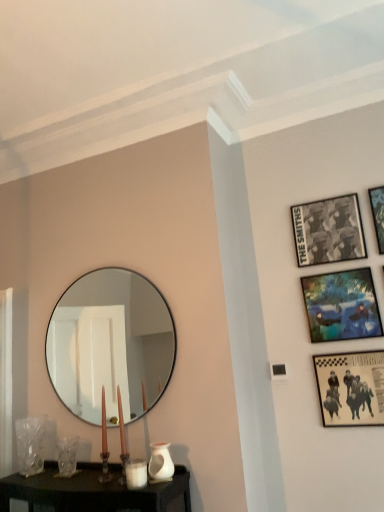
Question: Is black glass mirror at upper center to the left of white glossy vase at lower center from the viewer's perspective?

Choices:
 (A) yes
 (B) no

Answer: (A)

Question: Does black glass mirror at upper center have a lesser height compared to white glossy vase at lower center?

Choices:
 (A) no
 (B) yes

Answer: (A)

Question: Is white glossy vase at lower center located within black glass mirror at upper center?

Choices:
 (A) yes
 (B) no

Answer: (B)

Question: Is black glass mirror at upper center facing towards white glossy vase at lower center?

Choices:
 (A) yes
 (B) no

Answer: (B)

Question: Is black glass mirror at upper center facing away from white glossy vase at lower center?

Choices:
 (A) no
 (B) yes

Answer: (A)

Question: From a real-world perspective, is black glass mirror at upper center located beneath white glossy vase at lower center?

Choices:
 (A) yes
 (B) no

Answer: (B)

Question: Is white matte candle holder at lower center in front of black paper picture frame at upper right, the third picture frame in the bottom-to-top sequence?

Choices:
 (A) yes
 (B) no

Answer: (A)

Question: Does white matte candle holder at lower center lie behind black paper picture frame at upper right, positioned as the 2th picture frame in top-to-bottom order?

Choices:
 (A) no
 (B) yes

Answer: (A)

Question: From a real-world perspective, is white matte candle holder at lower center positioned under black paper picture frame at upper right, the third picture frame in the bottom-to-top sequence, based on gravity?

Choices:
 (A) no
 (B) yes

Answer: (B)

Question: Does white matte candle holder at lower center have a greater height compared to black paper picture frame at upper right, the third picture frame in the bottom-to-top sequence?

Choices:
 (A) no
 (B) yes

Answer: (A)

Question: Is white matte candle holder at lower center bigger than black paper picture frame at upper right, positioned as the 2th picture frame in top-to-bottom order?

Choices:
 (A) yes
 (B) no

Answer: (B)

Question: Can you confirm if white matte candle holder at lower center is thinner than black paper picture frame at upper right, the third picture frame in the bottom-to-top sequence?

Choices:
 (A) yes
 (B) no

Answer: (B)

Question: Can you confirm if white matte candle holder at lower center is positioned to the right of clear glass vase at lower left?

Choices:
 (A) no
 (B) yes

Answer: (B)